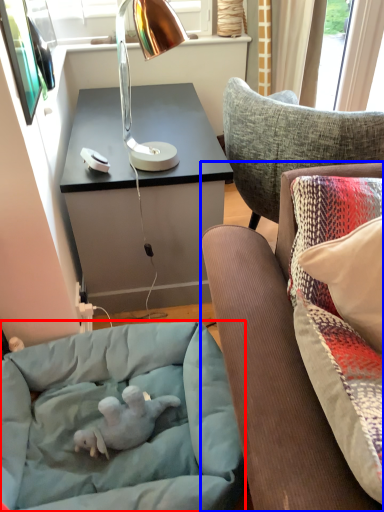
Question: Which object appears closest to the camera in this image, dog bed (highlighted by a red box) or studio couch (highlighted by a blue box)?

Choices:
 (A) dog bed
 (B) studio couch

Answer: (B)